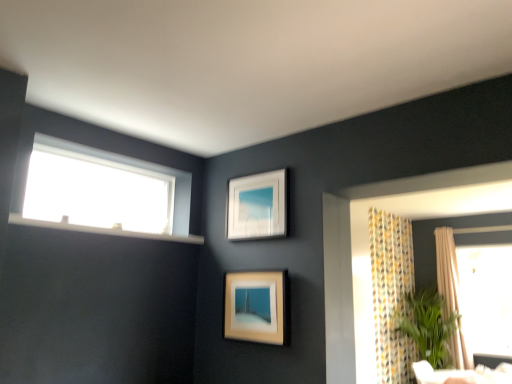
Question: Is beige textured curtain at right to the left or to the right of matte wooden picture frame at center, the 2th picture frame when ordered from top to bottom, in the image?

Choices:
 (A) right
 (B) left

Answer: (A)

Question: Is beige textured curtain at right bigger or smaller than matte wooden picture frame at center, which is the 1th picture frame from bottom to top?

Choices:
 (A) small
 (B) big

Answer: (B)

Question: Which object is the closest to the matte wooden picture frame at center, the 2th picture frame when ordered from top to bottom?

Choices:
 (A) beige textured curtain at right
 (B) white matte picture frame at upper center, which appears as the second picture frame when ordered from the bottom
 (C) green leafy plant at right
 (D) white plastic window sill at upper left
 (E) transparent glass window at upper left

Answer: (B)

Question: Considering the real-world distances, which object is closest to the white matte picture frame at upper center, which appears as the second picture frame when ordered from the bottom?

Choices:
 (A) white plastic window sill at upper left
 (B) beige textured curtain at right
 (C) matte wooden picture frame at center, which is the 1th picture frame from bottom to top
 (D) transparent glass window at upper left
 (E) green leafy plant at right

Answer: (C)